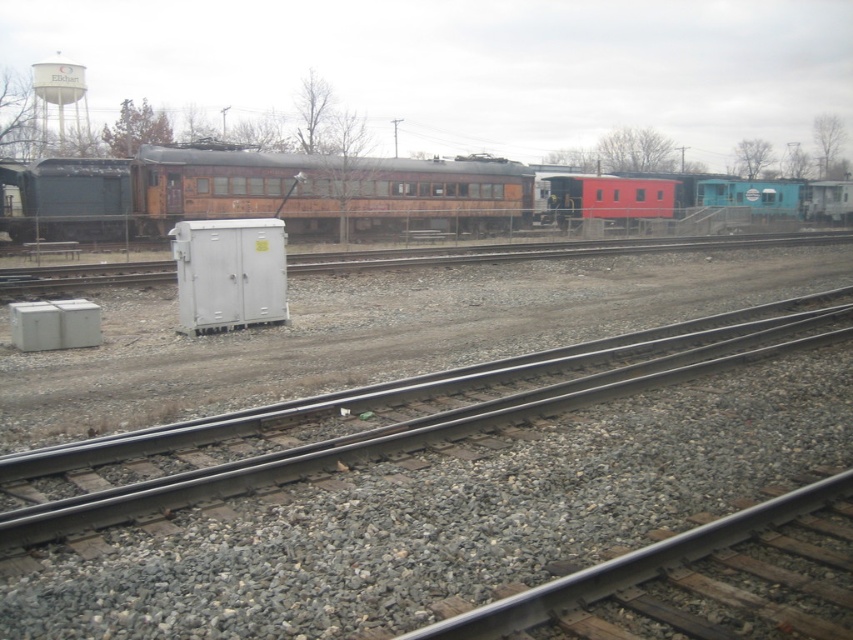
Question: Which of the following is the farthest from the observer?

Choices:
 (A) (177, 205)
 (B) (624, 200)
 (C) (439, 637)

Answer: (B)

Question: Is gray metallic train track at center below smooth red caboose at center?

Choices:
 (A) yes
 (B) no

Answer: (A)

Question: Which point is closer to the camera taking this photo?

Choices:
 (A) (62, 88)
 (B) (244, 156)
 (C) (219, 436)

Answer: (C)

Question: Estimate the real-world distances between objects in this image. Which object is closer to the smooth red caboose at center?

Choices:
 (A) gray gravel at lower left
 (B) gray metallic train track at center
 (C) white matte water tower at upper left

Answer: (B)

Question: Does gray gravel at lower left appear over smooth red caboose at center?

Choices:
 (A) no
 (B) yes

Answer: (A)

Question: Does wooden train car at center appear on the left side of white matte water tower at upper left?

Choices:
 (A) no
 (B) yes

Answer: (A)